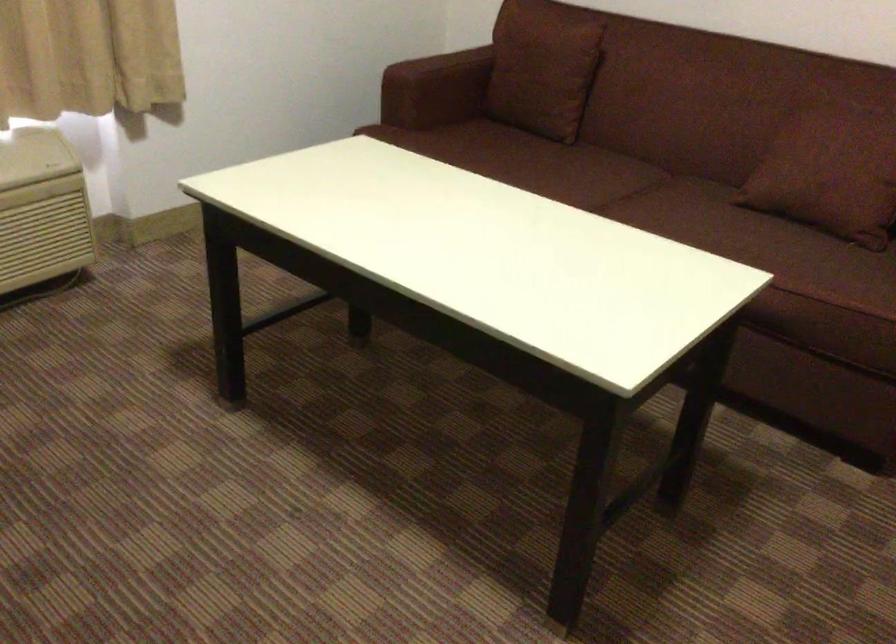
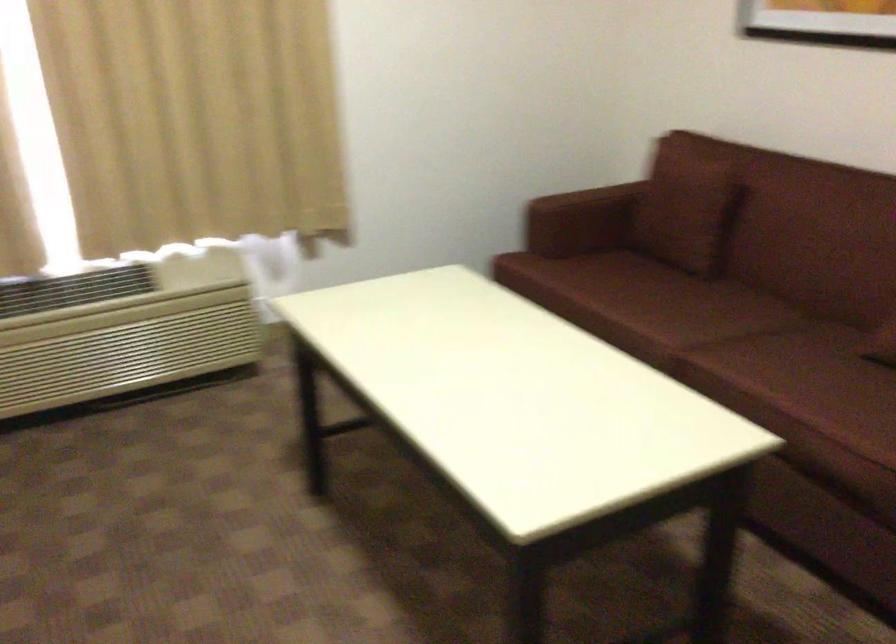
In the second image, find the point that corresponds to pixel 575 176 in the first image.

(682, 310)